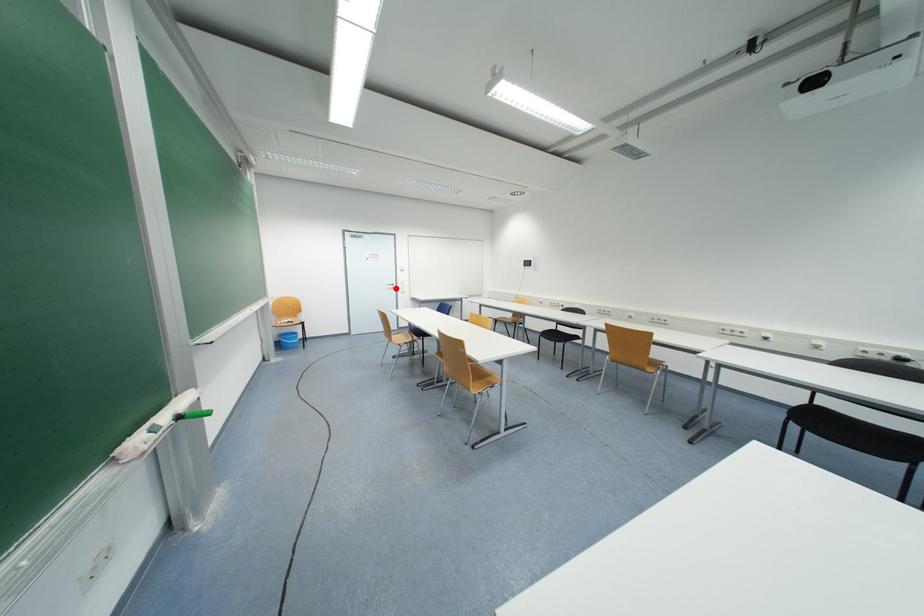
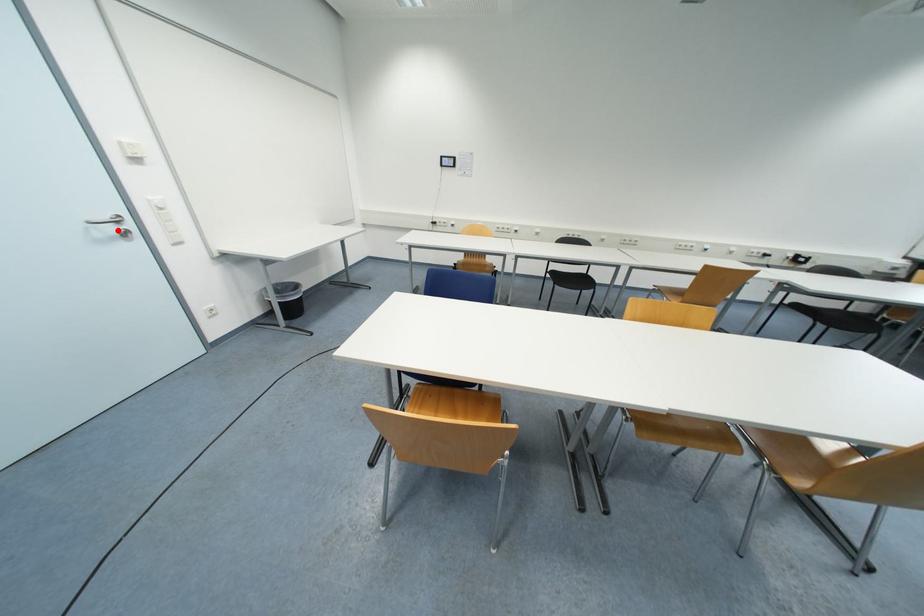
I am providing you with two images of the same scene from different viewpoints. A red point is marked on the first image and another point is marked on the second image. Is the red point in image1 aligned with the point shown in image2?

Yes